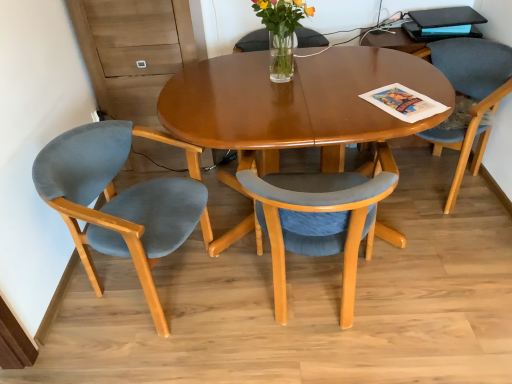
Identify the location of blue glossy magazine at upper right. The height and width of the screenshot is (384, 512). (447, 31).

Image resolution: width=512 pixels, height=384 pixels. Describe the element at coordinates (469, 95) in the screenshot. I see `gray fabric chair at right, the third chair in the left-to-right sequence` at that location.

What do you see at coordinates (281, 33) in the screenshot? The height and width of the screenshot is (384, 512). I see `translucent glass vase at center` at bounding box center [281, 33].

At what (x,y) coordinates should I click in order to perform the action: click on blue glossy magazine at upper right. Please return your answer as a coordinate pair (x, y). Looking at the image, I should click on (447, 31).

From the image's perspective, which is above, gray fabric chair at right, the third chair in the left-to-right sequence, or translucent glass vase at center?

translucent glass vase at center, from the image's perspective.

Where is `chair lying behind the translucent glass vase at center`? Image resolution: width=512 pixels, height=384 pixels. chair lying behind the translucent glass vase at center is located at coordinates (469, 95).

From a real-world perspective, is gray fabric chair at right, the 1th chair viewed from the right, below translucent glass vase at center?

Yes, from a real-world perspective, gray fabric chair at right, the 1th chair viewed from the right, is under translucent glass vase at center.

Which is in front, blue glossy magazine at upper right or matte blue fabric chair at center, acting as the 2th chair starting from the right?

matte blue fabric chair at center, acting as the 2th chair starting from the right, is more forward.

Is blue glossy magazine at upper right spatially inside matte blue fabric chair at center, which is counted as the second chair, starting from the left, or outside of it?

blue glossy magazine at upper right is located beyond the bounds of matte blue fabric chair at center, which is counted as the second chair, starting from the left.

Is blue glossy magazine at upper right smaller than matte blue fabric chair at center, which is counted as the second chair, starting from the left?

Yes, blue glossy magazine at upper right is smaller than matte blue fabric chair at center, which is counted as the second chair, starting from the left.

Between blue glossy magazine at upper right and translucent glass vase at center, which one has larger width?

With larger width is blue glossy magazine at upper right.

From the picture: Is blue glossy magazine at upper right not near translucent glass vase at center?

blue glossy magazine at upper right is actually quite close to translucent glass vase at center.

In the scene shown: Considering the sizes of objects translucent glass vase at center and clear glass vase at center in the image provided, who is wider, translucent glass vase at center or clear glass vase at center?

With larger width is translucent glass vase at center.

Does translucent glass vase at center contain clear glass vase at center?

No, translucent glass vase at center does not contain clear glass vase at center.

What's the angular difference between clear glass vase at center and gray fabric chair at right, the third chair in the left-to-right sequence,'s facing directions?

They differ by 57 degrees in their facing directions.

Between clear glass vase at center and gray fabric chair at right, the third chair in the left-to-right sequence, which one has less height?

Standing shorter between the two is clear glass vase at center.

Looking at this image, considering the relative sizes of clear glass vase at center and gray fabric chair at right, the third chair in the left-to-right sequence, in the image provided, is clear glass vase at center bigger than gray fabric chair at right, the third chair in the left-to-right sequence,?

Actually, clear glass vase at center might be smaller than gray fabric chair at right, the third chair in the left-to-right sequence.

You are a GUI agent. You are given a task and a screenshot of the screen. Output one action in this format:
    pyautogui.click(x=<x>, y=<y>)
    Task: Click on the magazine that is on the right side of gray fabric chair at right, the 1th chair viewed from the right
    The image size is (512, 384).
    Given the screenshot: What is the action you would take?
    pyautogui.click(x=447, y=31)

In terms of height, does gray fabric chair at right, the third chair in the left-to-right sequence, look taller or shorter compared to blue glossy magazine at upper right?

Clearly, gray fabric chair at right, the third chair in the left-to-right sequence, is taller compared to blue glossy magazine at upper right.

Consider the image. From the image's perspective, which one is positioned lower, gray fabric chair at right, the 1th chair viewed from the right, or blue glossy magazine at upper right?

gray fabric chair at right, the 1th chair viewed from the right, is shown below in the image.

Is gray fabric chair at right, the third chair in the left-to-right sequence, further to camera compared to blue glossy magazine at upper right?

No, gray fabric chair at right, the third chair in the left-to-right sequence, is closer to the camera.

In terms of width, does gray fabric chair at right, the third chair in the left-to-right sequence, look wider or thinner when compared to matte blue chair at left, marked as the third chair in a right-to-left arrangement?

Considering their sizes, gray fabric chair at right, the third chair in the left-to-right sequence, looks broader than matte blue chair at left, marked as the third chair in a right-to-left arrangement.

From a real-world perspective, who is located higher, gray fabric chair at right, the 1th chair viewed from the right, or matte blue chair at left, marked as the third chair in a right-to-left arrangement?

gray fabric chair at right, the 1th chair viewed from the right.

Can you confirm if gray fabric chair at right, the 1th chair viewed from the right, is positioned to the right of matte blue chair at left, marked as the third chair in a right-to-left arrangement?

Yes.

From the image's perspective, count 1st chairs downward from the translucent glass vase at center and point to it. Please provide its 2D coordinates.

[(469, 95)]

Locate an element on the screen. magazine behind the matte blue fabric chair at center, acting as the 2th chair starting from the right is located at coordinates (447, 31).

Estimate the real-world distances between objects in this image. Which object is further from matte blue chair at left, marked as the third chair in a right-to-left arrangement, matte blue fabric chair at center, acting as the 2th chair starting from the right, or gray fabric chair at right, the third chair in the left-to-right sequence?

Among the two, gray fabric chair at right, the third chair in the left-to-right sequence, is located further to matte blue chair at left, marked as the third chair in a right-to-left arrangement.

From the image, which object appears to be nearer to matte blue chair at left, which ranks as the 1th chair in left-to-right order, blue glossy magazine at upper right or translucent glass vase at center?

Among the two, translucent glass vase at center is located nearer to matte blue chair at left, which ranks as the 1th chair in left-to-right order.

Which object lies nearer to the anchor point translucent glass vase at center, gray fabric chair at right, the 1th chair viewed from the right, or blue glossy magazine at upper right?

blue glossy magazine at upper right is closer to translucent glass vase at center.

Which object lies further to the anchor point translucent glass vase at center, matte blue fabric chair at center, acting as the 2th chair starting from the right, or blue glossy magazine at upper right?

blue glossy magazine at upper right.

Considering their positions, is matte blue fabric chair at center, which is counted as the second chair, starting from the left, positioned closer to clear glass vase at center than translucent glass vase at center?

The object closer to clear glass vase at center is translucent glass vase at center.

Looking at the image, which one is located closer to clear glass vase at center, gray fabric chair at right, the third chair in the left-to-right sequence, or matte blue chair at left, marked as the third chair in a right-to-left arrangement?

Among the two, matte blue chair at left, marked as the third chair in a right-to-left arrangement, is located nearer to clear glass vase at center.

Estimate the real-world distances between objects in this image. Which object is further from matte blue chair at left, which ranks as the 1th chair in left-to-right order, clear glass vase at center or gray fabric chair at right, the third chair in the left-to-right sequence?

gray fabric chair at right, the third chair in the left-to-right sequence, is positioned further to the anchor matte blue chair at left, which ranks as the 1th chair in left-to-right order.

When comparing their distances from blue glossy magazine at upper right, does translucent glass vase at center or gray fabric chair at right, the 1th chair viewed from the right, seem closer?

gray fabric chair at right, the 1th chair viewed from the right, is closer to blue glossy magazine at upper right.

I want to click on floral arrangement between matte blue chair at left, which ranks as the 1th chair in left-to-right order, and gray fabric chair at right, the 1th chair viewed from the right, so click(281, 33).

Locate an element on the screen. Image resolution: width=512 pixels, height=384 pixels. floral arrangement between clear glass vase at center and matte blue chair at left, marked as the third chair in a right-to-left arrangement, in the up-down direction is located at coordinates (281, 33).

I want to click on floral arrangement between blue glossy magazine at upper right and matte blue fabric chair at center, which is counted as the second chair, starting from the left, in the up-down direction, so click(x=281, y=33).

Image resolution: width=512 pixels, height=384 pixels. In order to click on vase between matte blue chair at left, marked as the third chair in a right-to-left arrangement, and gray fabric chair at right, the third chair in the left-to-right sequence, in the horizontal direction in this screenshot , I will do point(281,57).